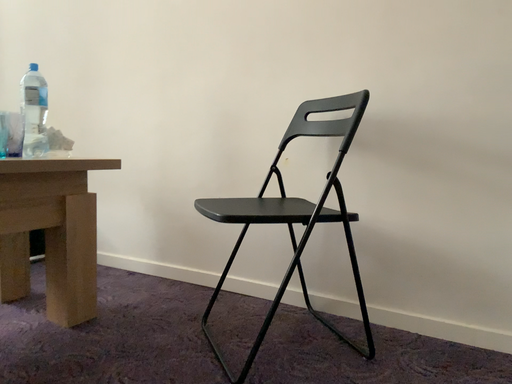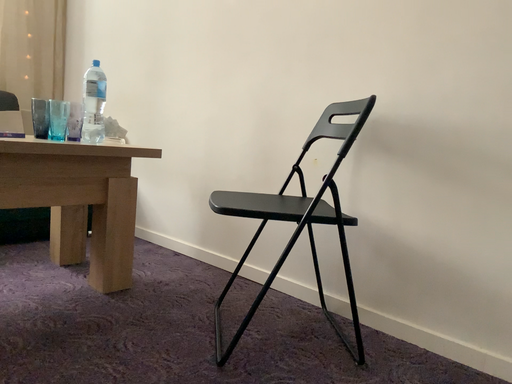
Question: Which way did the camera rotate in the video?

Choices:
 (A) rotated right
 (B) rotated left

Answer: (B)